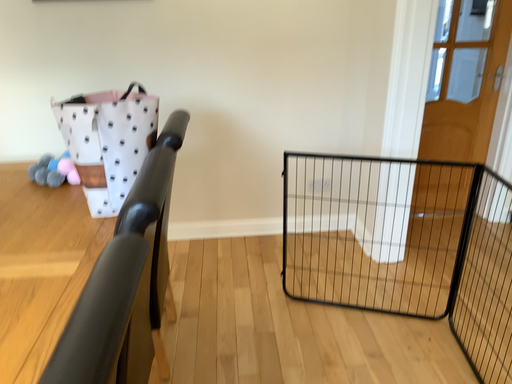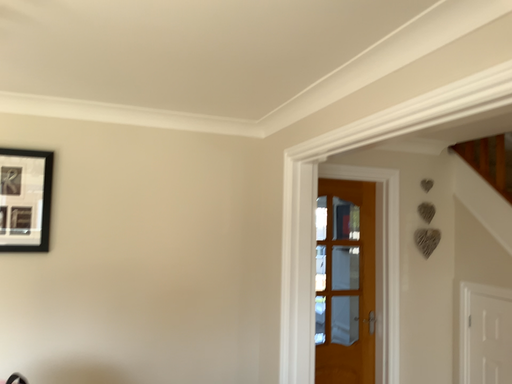
Question: How did the camera likely rotate when shooting the video?

Choices:
 (A) rotated right
 (B) rotated left

Answer: (A)